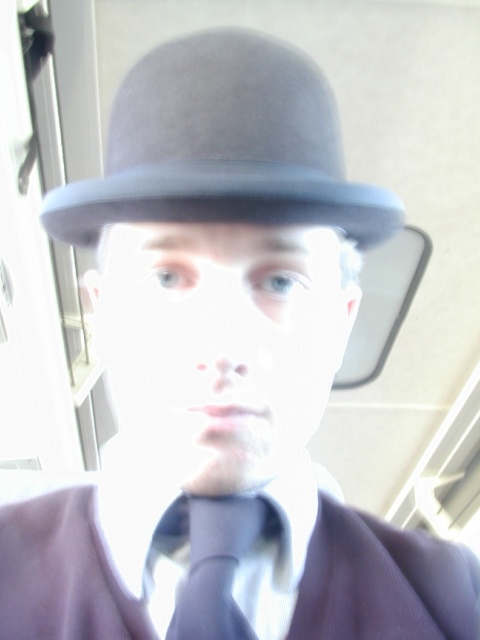
You are taking a selfie and notice two points on your face in the image. The first point is at coordinates point (365, 605) and the second is at point (214, 600). Which point is closer to the camera?

Point (365, 605) is further to the viewer than point (214, 600), so the point closer to the camera is point (214, 600).

You are a fashion designer analyzing the outfit of the person in the image. The person is wearing a matte gray fedora at upper center and a matte blue tie at center. Which of these two items has a greater width?

The matte gray fedora at upper center has a greater width than the matte blue tie at center.